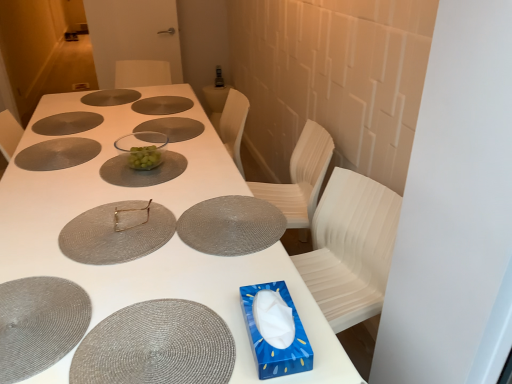
Image resolution: width=512 pixels, height=384 pixels. What are the coordinates of `empty space that is in between matte gray glass plate at upper left, which is the 5th glass plate in back-to-front order, and blue paper tissue box at lower right` in the screenshot? It's located at (120, 196).